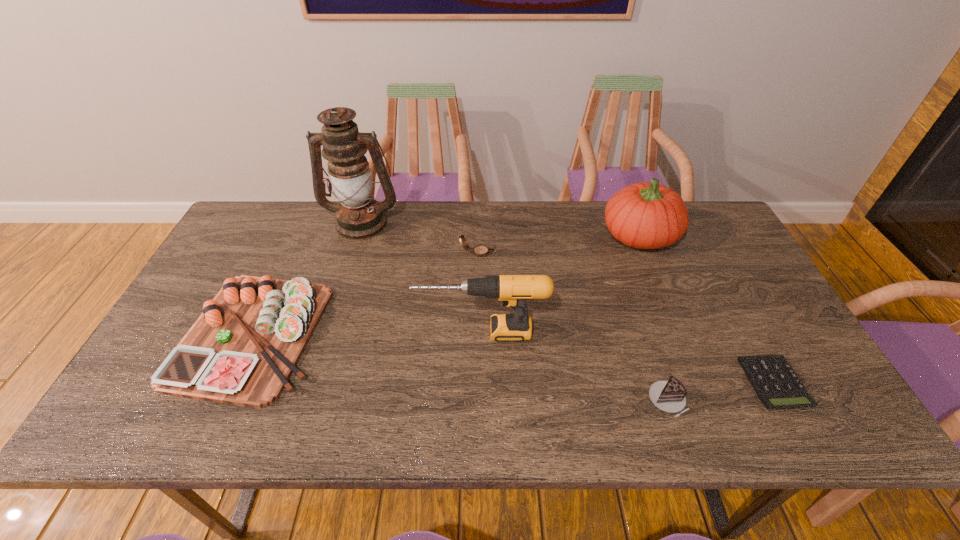
Where is `the fifth closest object relative to the drill`? The width and height of the screenshot is (960, 540). the fifth closest object relative to the drill is located at coordinates (359, 217).

Image resolution: width=960 pixels, height=540 pixels. I want to click on the sixth closest object to the calculator, so click(x=242, y=350).

Where is `free space that satisfies the following two spatial constraints: 1. on the back side of the second shortest object; 2. on the right side of the pumpkin`? This screenshot has height=540, width=960. free space that satisfies the following two spatial constraints: 1. on the back side of the second shortest object; 2. on the right side of the pumpkin is located at coordinates (613, 236).

Locate an element on the screen. Image resolution: width=960 pixels, height=540 pixels. free location that satisfies the following two spatial constraints: 1. on the handle side of the sixth tallest object; 2. on the right side of the drill is located at coordinates (482, 400).